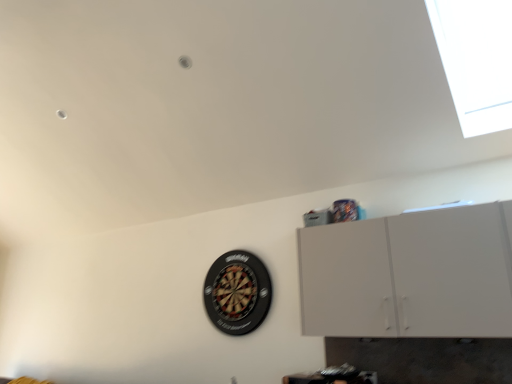
You are a GUI agent. You are given a task and a screenshot of the screen. Output one action in this format:
    pyautogui.click(x=<x>, y=<y>)
    Task: Click on the black plastic dartboard at center
    The image size is (512, 384).
    Given the screenshot: What is the action you would take?
    pos(237,292)

This screenshot has height=384, width=512. Describe the element at coordinates (409, 275) in the screenshot. I see `white matte cabinet at upper right` at that location.

The height and width of the screenshot is (384, 512). I want to click on transparent glass window at upper right, so click(476, 60).

Could you tell me if black plastic dartboard at center is turned towards transparent glass window at upper right?

No, black plastic dartboard at center does not turn towards transparent glass window at upper right.

Can you confirm if black plastic dartboard at center is positioned to the left of transparent glass window at upper right?

Yes.

Is black plastic dartboard at center positioned behind transparent glass window at upper right?

Yes, it is behind transparent glass window at upper right.

This screenshot has width=512, height=384. I want to click on wheel behind the transparent glass window at upper right, so click(237, 292).

From a real-world perspective, is transparent glass window at upper right physically below black plastic dartboard at center?

No, from a real-world perspective, transparent glass window at upper right is not under black plastic dartboard at center.

Is there a large distance between transparent glass window at upper right and black plastic dartboard at center?

Yes.

Does transparent glass window at upper right turn towards black plastic dartboard at center?

No, transparent glass window at upper right is not turned towards black plastic dartboard at center.

Based on the photo, considering the relative positions of transparent glass window at upper right and white matte cabinet at upper right in the image provided, is transparent glass window at upper right to the left of white matte cabinet at upper right from the viewer's perspective?

Incorrect, transparent glass window at upper right is not on the left side of white matte cabinet at upper right.

From the picture: Between transparent glass window at upper right and white matte cabinet at upper right, which one has smaller width?

white matte cabinet at upper right.

Where is `cabinetry lying behind the transparent glass window at upper right`? cabinetry lying behind the transparent glass window at upper right is located at coordinates (409, 275).

Is black plastic dartboard at center far from white matte cabinet at upper right?

Actually, black plastic dartboard at center and white matte cabinet at upper right are a little close together.

Who is taller, black plastic dartboard at center or white matte cabinet at upper right?

With more height is white matte cabinet at upper right.

Which point is more forward, (246, 258) or (348, 330)?

The point (348, 330) is closer to the camera.

Can you confirm if black plastic dartboard at center is smaller than white matte cabinet at upper right?

Yes, black plastic dartboard at center is smaller than white matte cabinet at upper right.

Between white matte cabinet at upper right and transparent glass window at upper right, which one has larger size?

transparent glass window at upper right.

Is point (477, 228) more distant than point (433, 2)?

That is True.

From the image's perspective, is white matte cabinet at upper right beneath transparent glass window at upper right?

Yes.

Based on the photo, in the image, is white matte cabinet at upper right on the left side or the right side of transparent glass window at upper right?

white matte cabinet at upper right is to the left of transparent glass window at upper right.

Which object is closer to the camera, white matte cabinet at upper right or black plastic dartboard at center?

white matte cabinet at upper right is closer to the camera.

How different are the orientations of white matte cabinet at upper right and black plastic dartboard at center in degrees?

They differ by 0.761 degrees in their facing directions.

In terms of width, does white matte cabinet at upper right look wider or thinner when compared to black plastic dartboard at center?

In the image, white matte cabinet at upper right appears to be wider than black plastic dartboard at center.

Between white matte cabinet at upper right and black plastic dartboard at center, which one has smaller size?

With smaller size is black plastic dartboard at center.

Where is `wheel that is below the transparent glass window at upper right (from the image's perspective)`? The image size is (512, 384). wheel that is below the transparent glass window at upper right (from the image's perspective) is located at coordinates [x=237, y=292].

The height and width of the screenshot is (384, 512). I want to click on wheel below the transparent glass window at upper right (from a real-world perspective), so click(x=237, y=292).

Looking at the image, which one is located closer to transparent glass window at upper right, white matte cabinet at upper right or black plastic dartboard at center?

white matte cabinet at upper right.

From the image, which object appears to be farther from white matte cabinet at upper right, transparent glass window at upper right or black plastic dartboard at center?

black plastic dartboard at center lies further to white matte cabinet at upper right than the other object.

Considering their positions, is black plastic dartboard at center positioned further to transparent glass window at upper right than white matte cabinet at upper right?

Among the two, black plastic dartboard at center is located further to transparent glass window at upper right.

When comparing their distances from white matte cabinet at upper right, does black plastic dartboard at center or transparent glass window at upper right seem closer?

transparent glass window at upper right lies closer to white matte cabinet at upper right than the other object.

Based on their spatial positions, is transparent glass window at upper right or white matte cabinet at upper right closer to black plastic dartboard at center?

white matte cabinet at upper right is positioned closer to the anchor black plastic dartboard at center.

Which object lies further to the anchor point black plastic dartboard at center, white matte cabinet at upper right or transparent glass window at upper right?

Among the two, transparent glass window at upper right is located further to black plastic dartboard at center.

The image size is (512, 384). I want to click on cabinetry between transparent glass window at upper right and black plastic dartboard at center in the up-down direction, so click(x=409, y=275).